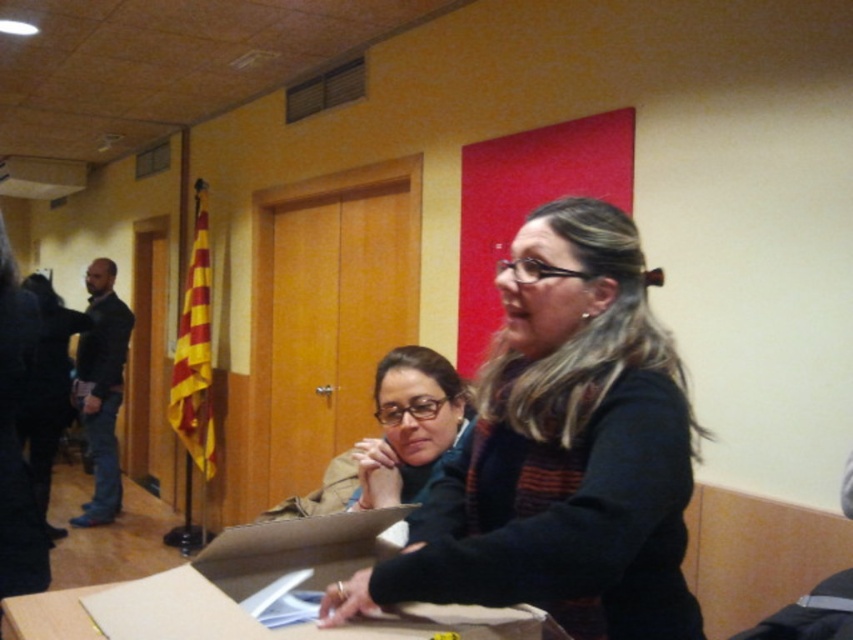
You are organizing a small event and need to place the brown cardboard box at center and the matte black glasses at center on a shelf. Which object should you place first to ensure both fit properly?

Since the brown cardboard box at center is larger than the matte black glasses at center, you should place the brown cardboard box at center first to ensure both items fit on the shelf.

You are an event organizer setting up for a community meeting. You have a black sweater at center and a brown cardboard box at center. Where should you place a new decorative flag to ensure it is visible above both items?

The black sweater at center is located above the brown cardboard box at center. To ensure the decorative flag is visible above both items, place it above the black sweater at center.

You are organizing a community event and need to place a decorative item on the table. The table has the black sweater at center and the brown cardboard box at center. Where should you place the item so it doesn t interfere with either object?

Place the decorative item to the left of the brown cardboard box at center, since the black sweater at center is on the right side of the box and the box itself is at the center, leaving space to the left.